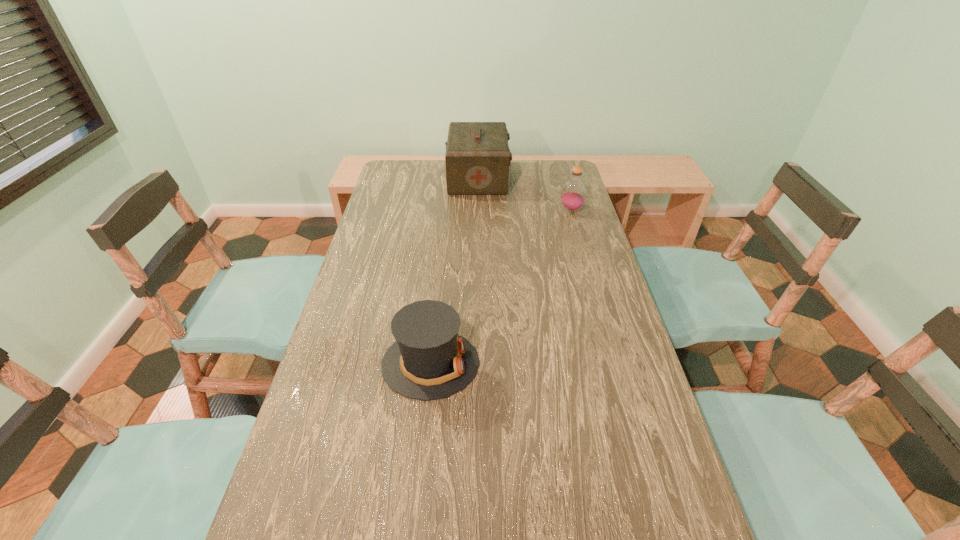
At what (x,y) coordinates should I click in order to perform the action: click on vacant area that satisfies the following two spatial constraints: 1. on the front side of the second nearest object; 2. on the right side of the first-aid kit. Please return your answer as a coordinate pair (x, y). Looking at the image, I should click on (478, 210).